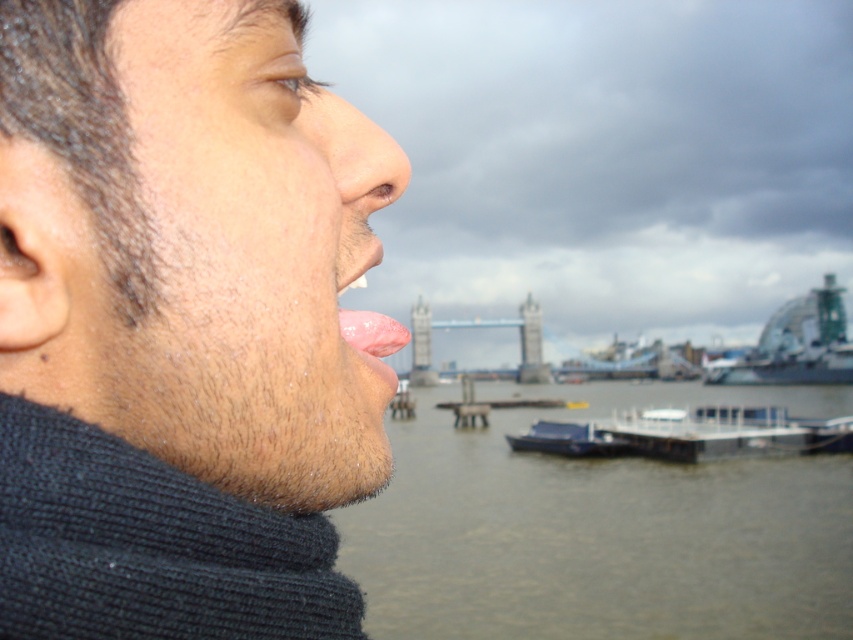
You are a photographer standing at the scene described. You want to capture a photo of the pink flesh at center while ensuring the metallic gray boat at lower center is visible in the background. Given the distance between them, will you need to adjust your camera settings to focus on both objects simultaneously?

The metallic gray boat at lower center is 112.91 meters away from the pink flesh at center. Due to this significant distance, adjusting the camera settings to focus on both simultaneously may be challenging. A narrower aperture might help increase depth of field for both objects to be in focus.

You are a photographer trying to capture a candid shot of the person and the boat in the background. Based on the scene, which object is positioned closer to you, the photographer, when focusing on the pink flesh at center and the smooth blue boat at center?

The pink flesh at center is closer to the viewer than the smooth blue boat at center, so when focusing on them, the photographer would have the pink flesh at center in the foreground and the smooth blue boat at center in the background.

You are a photographer trying to capture the scenic river view behind the person. You notice two points marked on your camera screen at coordinates point [401,164] and point [531,305]. To ensure the background is clear of any obstructions, which point should you focus on to avoid the person in the foreground?

Point [401,164] is in front of point [531,305], so focusing on point [531,305] would avoid the person in the foreground because it is further back.